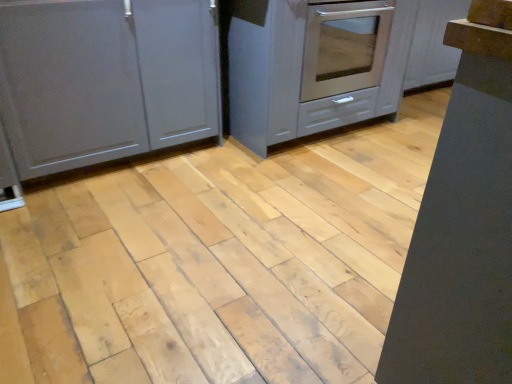
Question: Should I look upward or downward to see satin gray cabinet at center, which is the 2th cabinetry from left to right?

Choices:
 (A) up
 (B) down

Answer: (A)

Question: Is matte gray cabinet at left, the 1th cabinetry in the left-to-right sequence, not close to satin gray cabinet at center, which is the 2th cabinetry from left to right?

Choices:
 (A) no
 (B) yes

Answer: (A)

Question: Does matte gray cabinet at left, which ranks as the 2th cabinetry in right-to-left order, lie behind satin gray cabinet at center, which is the 2th cabinetry from left to right?

Choices:
 (A) no
 (B) yes

Answer: (A)

Question: From the image's perspective, would you say matte gray cabinet at left, the 1th cabinetry in the left-to-right sequence, is shown under satin gray cabinet at center, the 1th cabinetry in the right-to-left sequence?

Choices:
 (A) no
 (B) yes

Answer: (B)

Question: Can you confirm if matte gray cabinet at left, which ranks as the 2th cabinetry in right-to-left order, is bigger than satin gray cabinet at center, the 1th cabinetry in the right-to-left sequence?

Choices:
 (A) yes
 (B) no

Answer: (B)

Question: Considering the relative sizes of matte gray cabinet at left, the 1th cabinetry in the left-to-right sequence, and satin gray cabinet at center, which is the 2th cabinetry from left to right, in the image provided, is matte gray cabinet at left, the 1th cabinetry in the left-to-right sequence, taller than satin gray cabinet at center, which is the 2th cabinetry from left to right,?

Choices:
 (A) yes
 (B) no

Answer: (A)

Question: Can you see matte gray cabinet at left, which ranks as the 2th cabinetry in right-to-left order, touching satin gray cabinet at center, the 1th cabinetry in the right-to-left sequence?

Choices:
 (A) yes
 (B) no

Answer: (B)

Question: Can you confirm if satin gray cabinet at center, the 1th cabinetry in the right-to-left sequence, is bigger than matte gray cabinet at left, the 1th cabinetry in the left-to-right sequence?

Choices:
 (A) no
 (B) yes

Answer: (B)

Question: Is satin gray cabinet at center, the 1th cabinetry in the right-to-left sequence, smaller than matte gray cabinet at left, the 1th cabinetry in the left-to-right sequence?

Choices:
 (A) yes
 (B) no

Answer: (B)

Question: Does satin gray cabinet at center, which is the 2th cabinetry from left to right, have a greater height compared to matte gray cabinet at left, which ranks as the 2th cabinetry in right-to-left order?

Choices:
 (A) no
 (B) yes

Answer: (A)

Question: Is satin gray cabinet at center, the 1th cabinetry in the right-to-left sequence, further to the viewer compared to matte gray cabinet at left, the 1th cabinetry in the left-to-right sequence?

Choices:
 (A) no
 (B) yes

Answer: (B)

Question: From the image's perspective, would you say satin gray cabinet at center, the 1th cabinetry in the right-to-left sequence, is positioned over matte gray cabinet at left, the 1th cabinetry in the left-to-right sequence?

Choices:
 (A) yes
 (B) no

Answer: (A)

Question: Is matte gray cabinet at left, which ranks as the 2th cabinetry in right-to-left order, at the back of satin gray cabinet at center, which is the 2th cabinetry from left to right?

Choices:
 (A) yes
 (B) no

Answer: (B)

Question: Is satin gray cabinet at center, which is the 2th cabinetry from left to right, bigger or smaller than matte gray cabinet at left, which ranks as the 2th cabinetry in right-to-left order?

Choices:
 (A) big
 (B) small

Answer: (A)